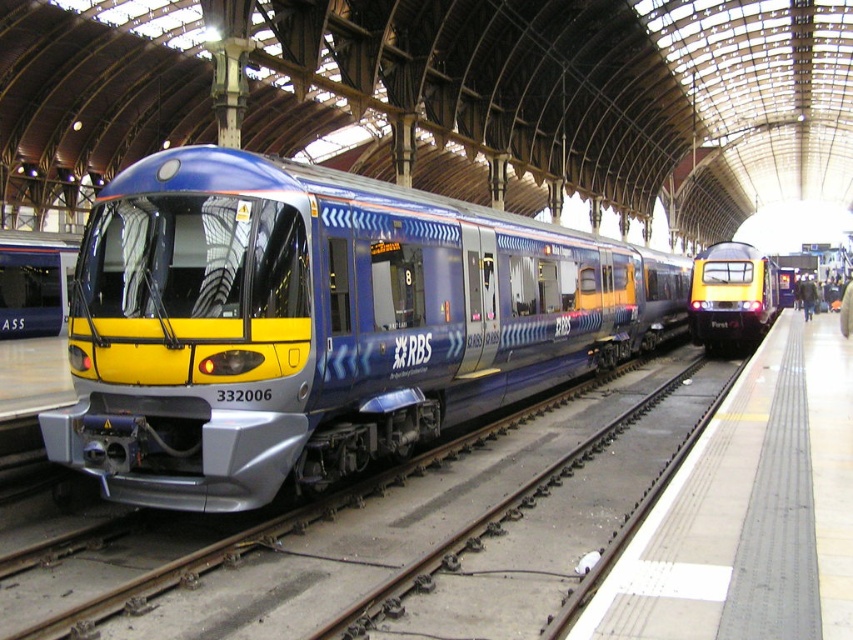
Question: Does metallic train track at center have a lesser width compared to yellow glossy train at right?

Choices:
 (A) yes
 (B) no

Answer: (B)

Question: Which object is positioned closest to the metallic train track at center?

Choices:
 (A) matte blue train at center
 (B) gray concrete platform at right
 (C) metallic blue train at center
 (D) yellow glossy train at right

Answer: (B)

Question: Is metallic train track at center to the left of gray concrete platform at right from the viewer's perspective?

Choices:
 (A) no
 (B) yes

Answer: (B)

Question: Which point appears farthest from the camera in this image?

Choices:
 (A) (749, 298)
 (B) (189, 438)
 (C) (19, 305)

Answer: (A)

Question: In this image, where is gray concrete platform at right located relative to yellow glossy train at right?

Choices:
 (A) above
 (B) below

Answer: (B)

Question: Which object appears closest to the camera in this image?

Choices:
 (A) gray concrete platform at right
 (B) metallic train track at center

Answer: (A)